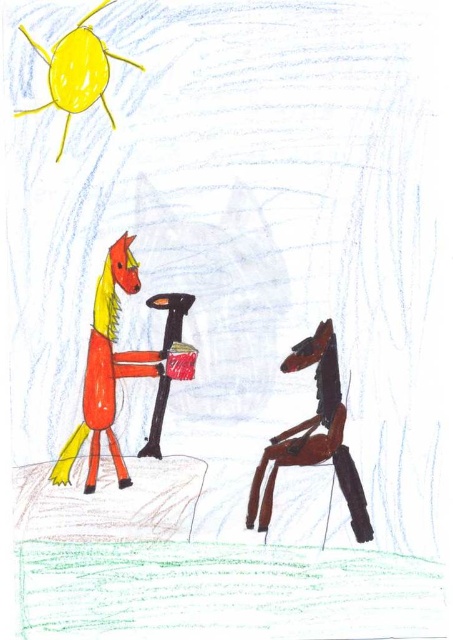
Who is lower down, shiny brown horse at right or smooth yellow horse at upper left?

shiny brown horse at right is below.

Is shiny brown horse at right taller than smooth yellow horse at upper left?

Correct, shiny brown horse at right is much taller as smooth yellow horse at upper left.

Who is more distant from viewer, (355, 468) or (72, 80)?

The point (355, 468) is behind.

The height and width of the screenshot is (640, 453). I want to click on shiny brown horse at right, so click(313, 435).

Who is higher up, smooth orange horse at left or smooth yellow horse at upper left?

smooth yellow horse at upper left

Between smooth orange horse at left and smooth yellow horse at upper left, which one appears on the right side from the viewer's perspective?

From the viewer's perspective, smooth orange horse at left appears more on the right side.

Which is behind, point (101, 416) or point (61, 77)?

Point (101, 416)

The image size is (453, 640). Find the location of `smooth orange horse at left`. smooth orange horse at left is located at coordinates (106, 369).

Does smooth orange horse at left appear on the left side of shiny brown horse at right?

Correct, you'll find smooth orange horse at left to the left of shiny brown horse at right.

Where is `smooth orange horse at left`? The height and width of the screenshot is (640, 453). smooth orange horse at left is located at coordinates (106, 369).